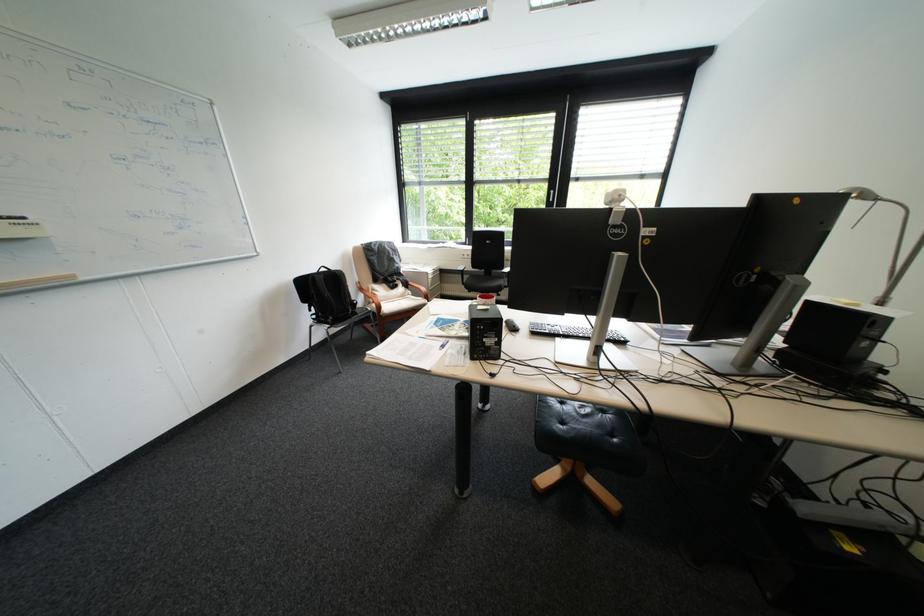
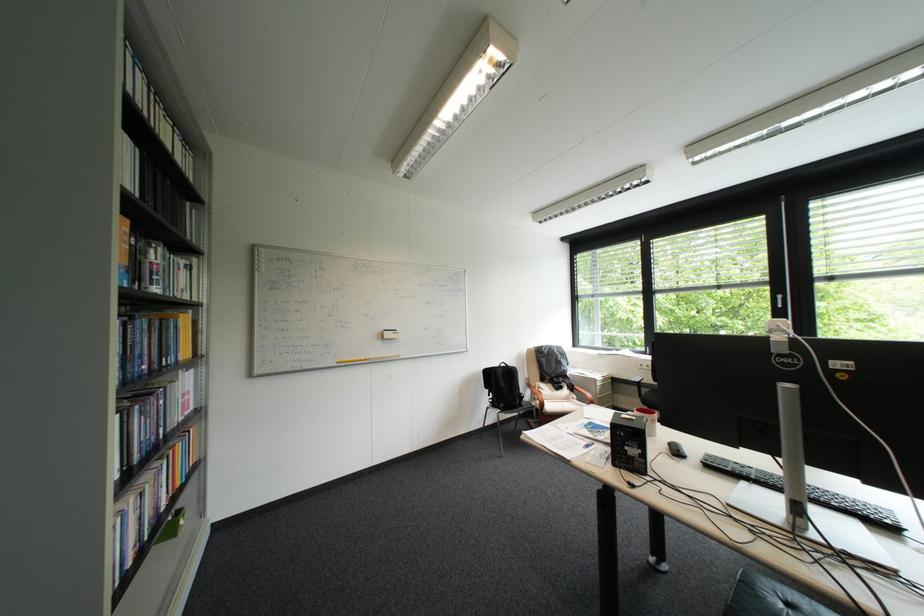
Locate, in the second image, the point that corresponds to pixel 518 323 in the first image.

(682, 445)